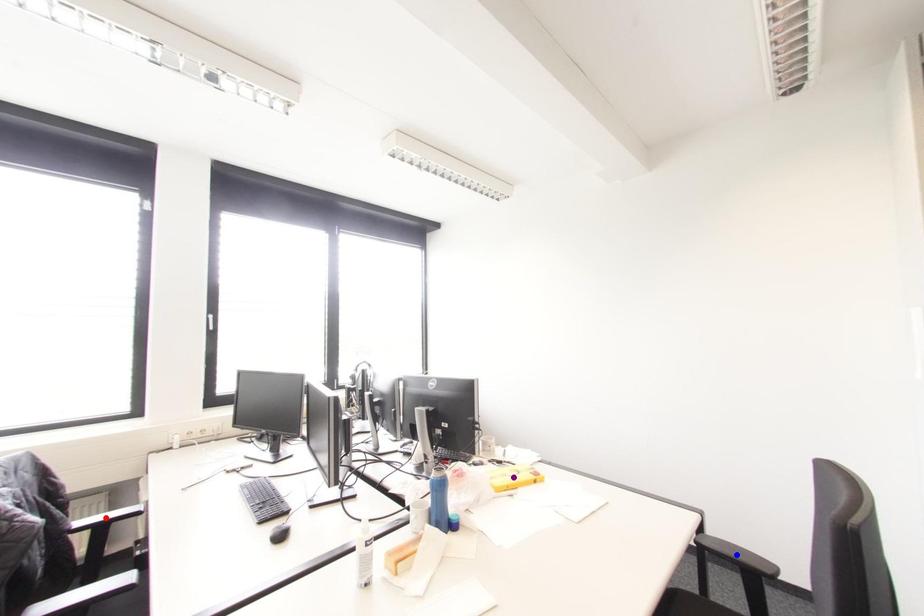
Order these from nearest to farthest:
A) red point
B) blue point
C) purple point

red point, blue point, purple point